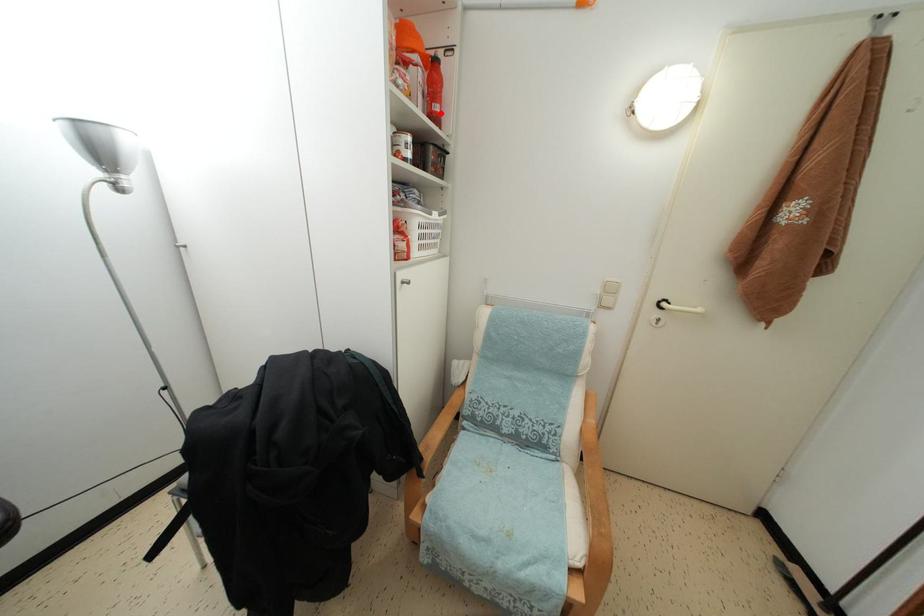
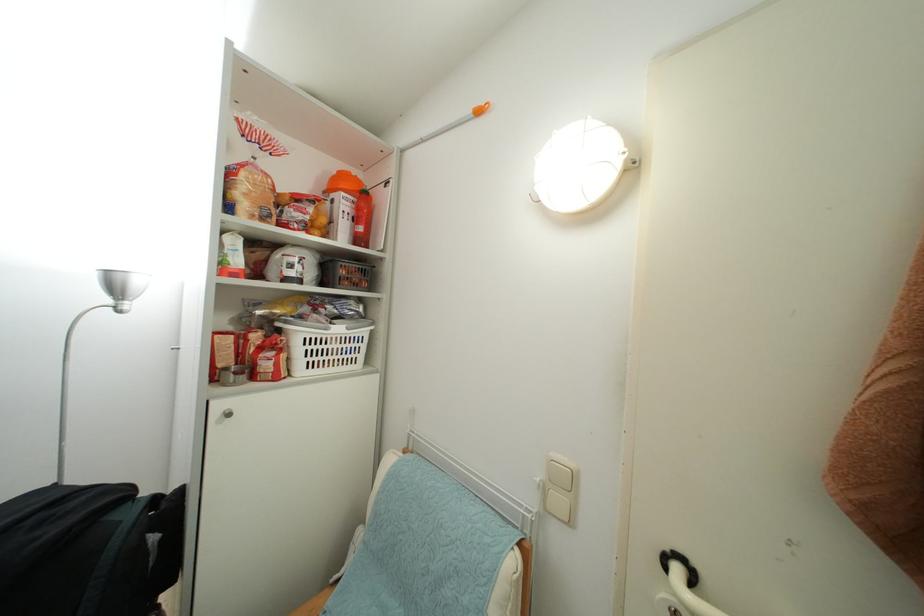
Question: I am providing you with two images of the same scene from different viewpoints. A red point is marked on the first image. At the location where the point appears in image 1, is it still visible in image 2?

Choices:
 (A) Yes
 (B) No

Answer: (A)